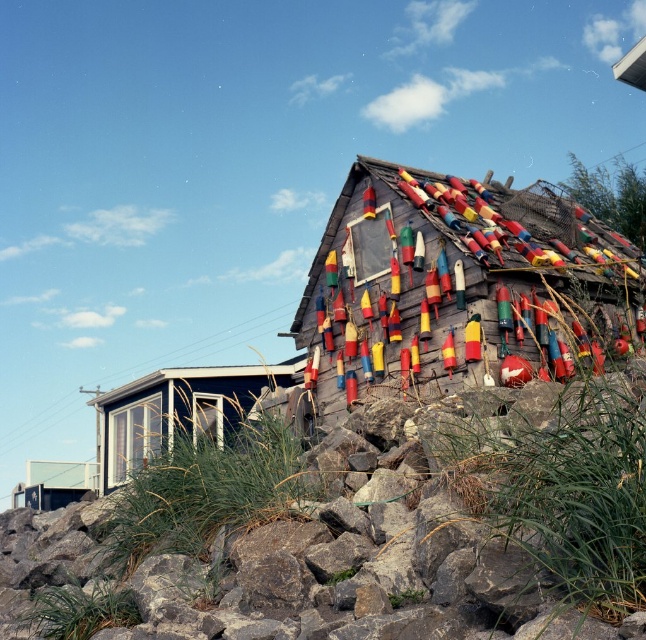
Who is higher up, wooden buoys at upper right or matte black cabin at lower left?

Positioned higher is wooden buoys at upper right.

Consider the image. Can you confirm if wooden buoys at upper right is shorter than matte black cabin at lower left?

Incorrect, wooden buoys at upper right's height does not fall short of matte black cabin at lower left's.

Measure the distance between wooden buoys at upper right and camera.

They are 6.42 meters apart.

Where is `wooden buoys at upper right`? The width and height of the screenshot is (646, 640). wooden buoys at upper right is located at coordinates (457, 285).